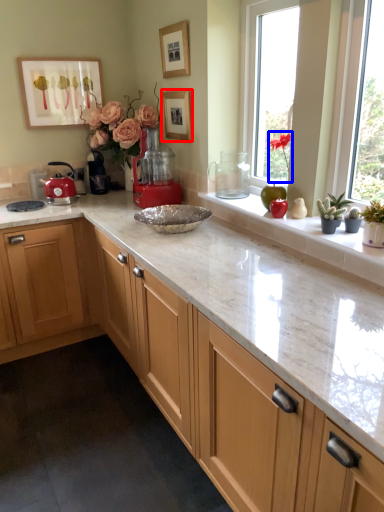
Question: Which object is further to the camera taking this photo, picture frame (highlighted by a red box) or plant (highlighted by a blue box)?

Choices:
 (A) picture frame
 (B) plant

Answer: (A)